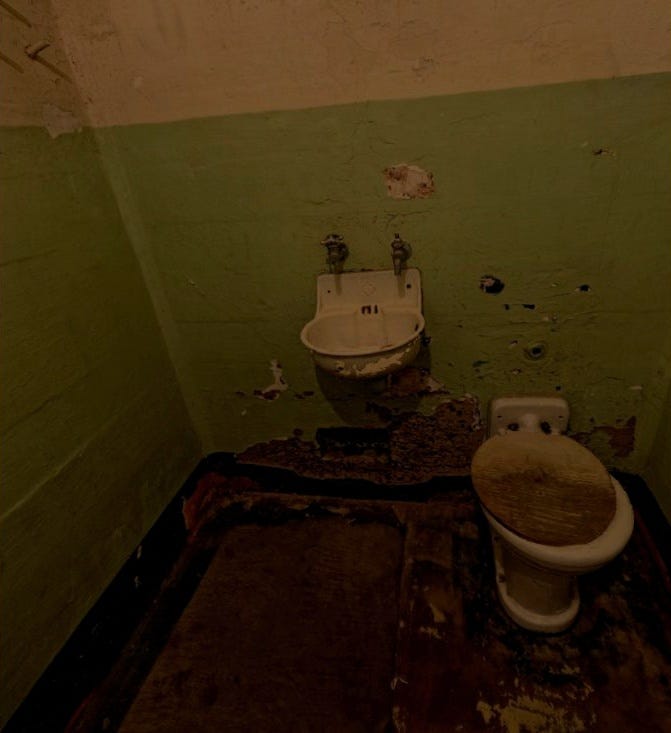
I want to click on left handle, so click(338, 246).